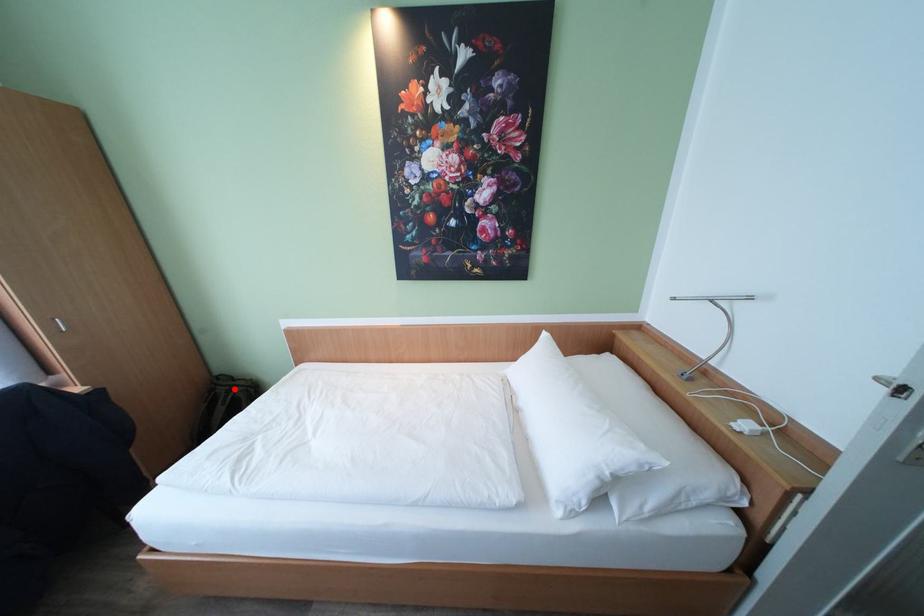
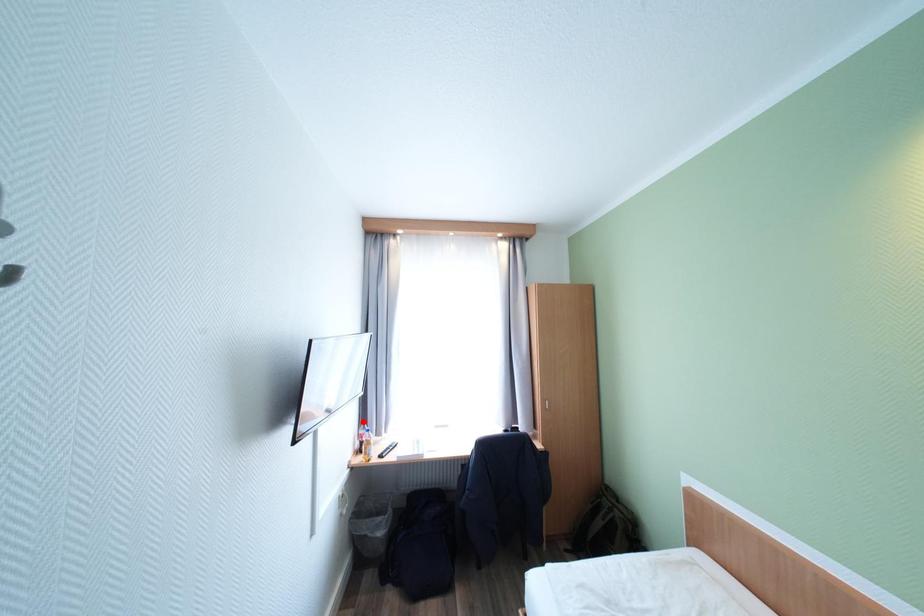
I am providing you with two images of the same scene from different viewpoints. A red point is marked on the first image and another point is marked on the second image. Is the marked point in image1 the same physical position as the marked point in image2?

No